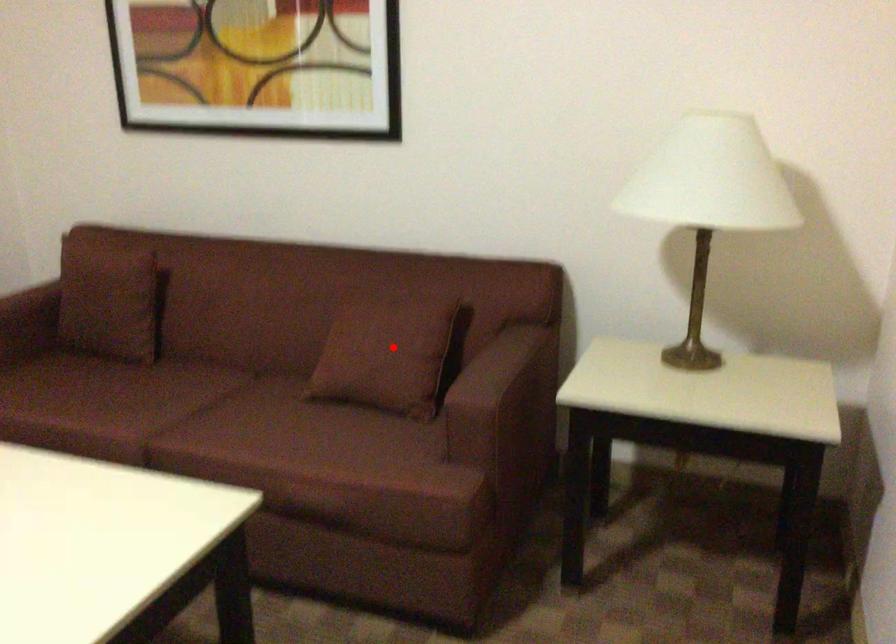
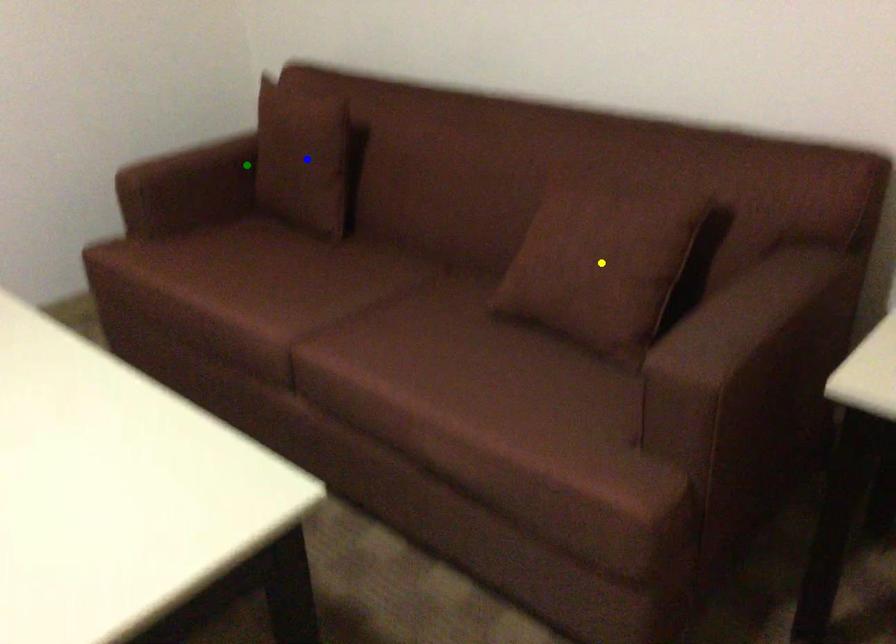
Question: I am providing you with two images of the same scene from different viewpoints. A red point is marked on the first image. You are given multiple points on the second image. In image 2, which mark is for the same physical point as the one in image 1?

Choices:
 (A) yellow point
 (B) blue point
 (C) green point

Answer: (A)